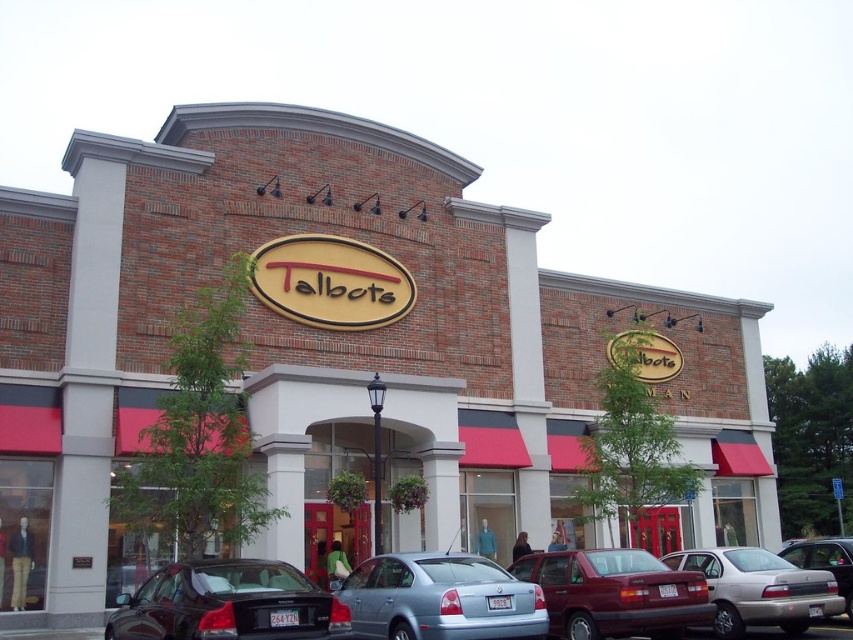
Which is more to the left, matte red sedan at center or metallic silver sedan at lower right?

matte red sedan at center is more to the left.

Where is `matte red sedan at center`? matte red sedan at center is located at coordinates (614, 593).

This screenshot has width=853, height=640. What are the coordinates of `shiny black sedan at lower left` in the screenshot? It's located at (228, 604).

Does point (173, 593) lie behind point (784, 554)?

No, (173, 593) is in front of (784, 554).

This screenshot has width=853, height=640. Find the location of `shiny black sedan at lower left`. shiny black sedan at lower left is located at coordinates click(x=228, y=604).

Which is more to the right, silver metallic sedan at center or metallic silver sedan at lower right?

metallic silver sedan at lower right is more to the right.

Can you confirm if silver metallic sedan at center is wider than metallic silver sedan at lower right?

In fact, silver metallic sedan at center might be narrower than metallic silver sedan at lower right.

Who is more forward, (772, 589) or (791, 556)?

Point (772, 589) is in front.

Find the location of a particular element. silver metallic sedan at center is located at coordinates (759, 588).